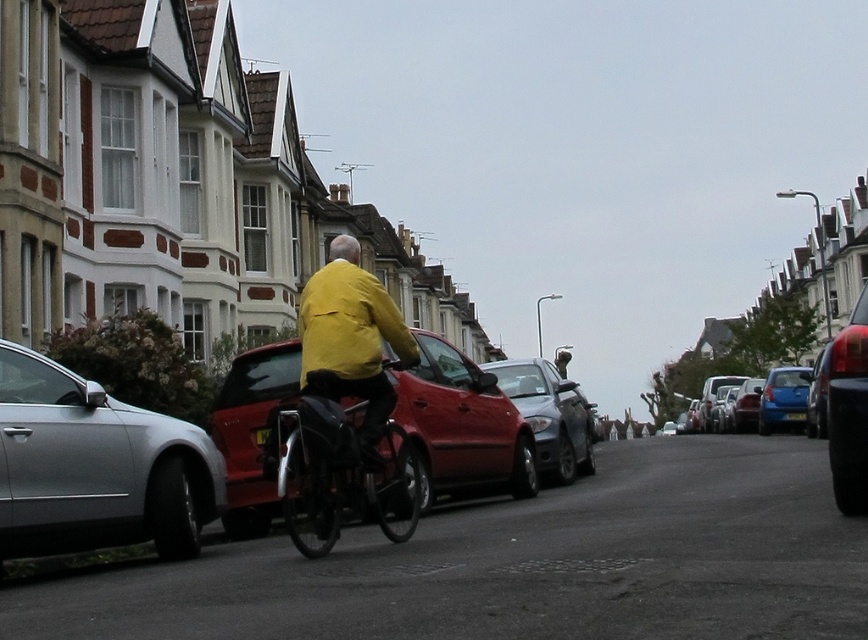
You are standing at the camera position looking at the residential street scene. There is a specific point marked at coordinates point (293, 456). If you want to place a 1.5 meter wide garden bench at this point, will it fit without overlapping any parked cars or houses?

The point (293, 456) is 7.65 meters away from the camera. Since the bench is 1.5 meters wide, it can be placed at this point as long as there is sufficient space. However, without knowing the exact layout of parked cars and houses around the point, it is impossible to confirm if the bench will overlap with them. The distance from the camera alone does not provide information about the surrounding obstacles.

You are standing on the residential street depicted in the scene. You want to cross the street to reach the terraced houses on the left. The shiny black car at right is blocking your path. Can you safely walk around the car to continue towards the houses?

The shiny black car at right is 24.83 feet away from you. Since the car is parked and not moving, you can safely walk around it to continue towards the terraced houses on the left.

Based on the photo, you are a delivery person trying to park your motorcycle between the metallic silver bicycle at center and the metallic silver sedan at center right. Given that your motorcycle is 1.2 meters wide, can you fit it in the space between them?

The metallic silver bicycle at center is wider than the metallic silver sedan at center right. Therefore, the space between them may not be sufficient for your motorcycle which is 1.2 meters wide. You should check the exact measurements before attempting to park.